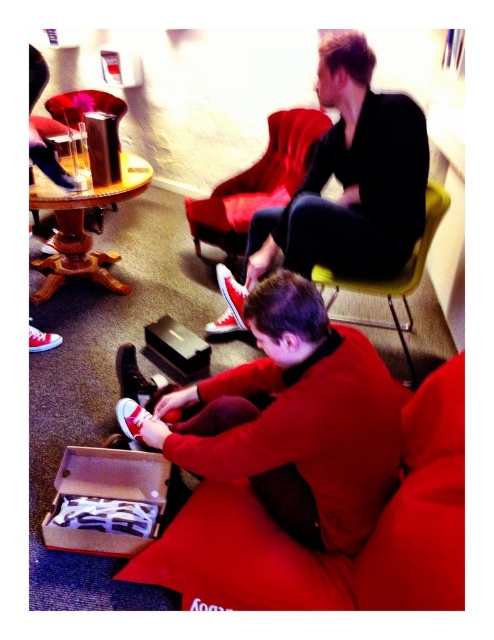
You are a delivery person who needs to place a package between the velvet red couch at lower center and the red suede shoe at lower center. Can you fit the package if it requires 20 inches of space?

The distance between the velvet red couch at lower center and the red suede shoe at lower center is 19.80 inches, which is slightly less than the required 20 inches. Therefore, the package cannot be placed there due to insufficient space.

You are a guest in this living room and want to place a small gift on the nearest surface. Which object between the velvet red couch at lower center and the matte black shoe box at lower center should you choose?

The velvet red couch at lower center is in front of the matte black shoe box at lower center, so the velvet red couch at lower center is closer to you. You should place the gift on the velvet red couch at lower center.